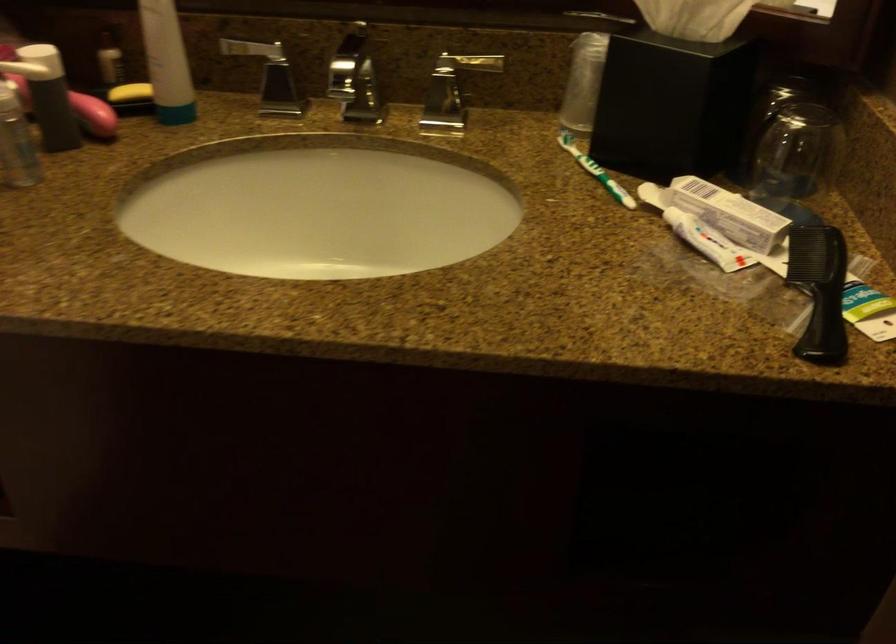
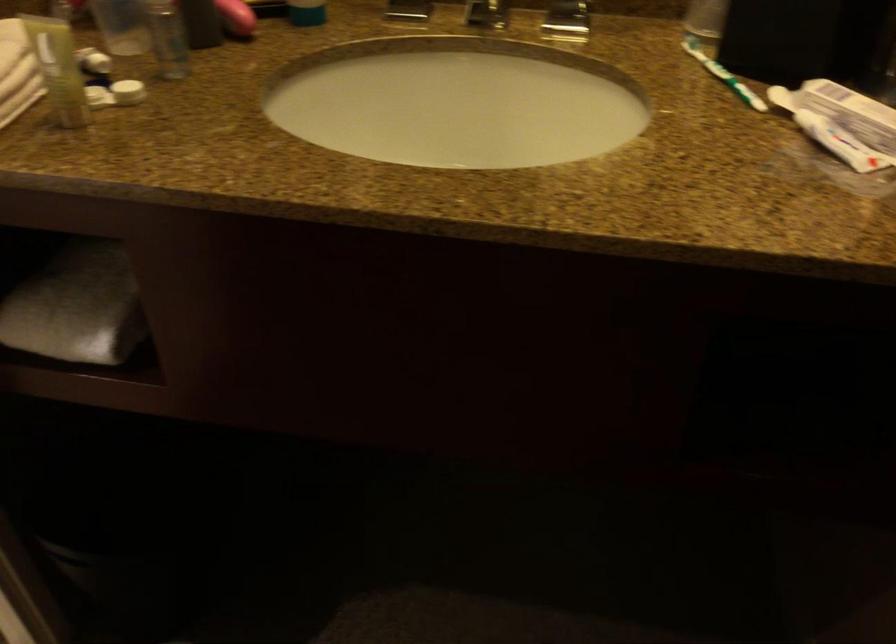
Question: The camera is either moving clockwise (left) or counter-clockwise (right) around the object. The first image is from the beginning of the video and the second image is from the end. Is the camera moving left or right when shooting the video?

Choices:
 (A) Left
 (B) Right

Answer: (B)